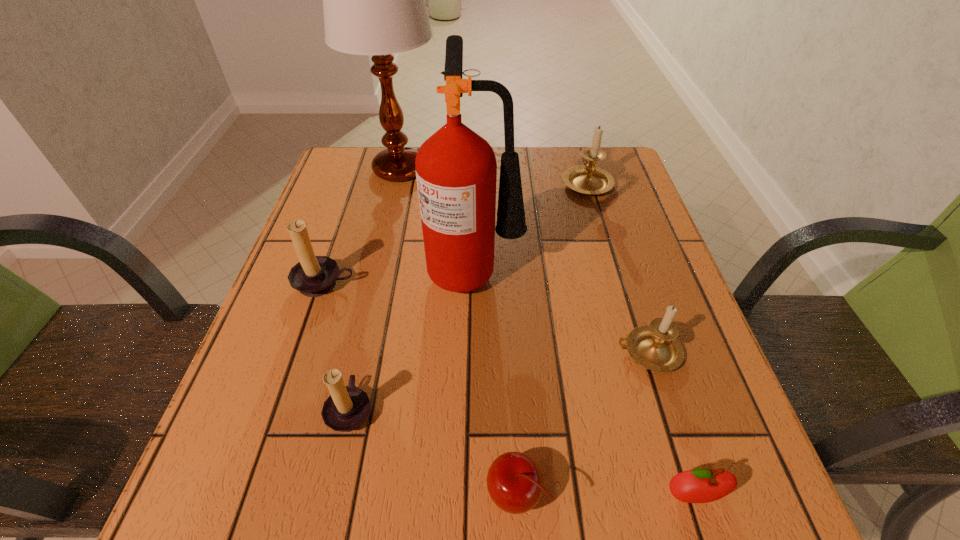
The image size is (960, 540). Identify the location of free space that is in between the cherry and the third candle holder from right to left. (432, 451).

Where is `free space between the nearer beige candle holder and the cherry`? The image size is (960, 540). free space between the nearer beige candle holder and the cherry is located at coordinates (581, 422).

The width and height of the screenshot is (960, 540). Identify the location of unoccupied position between the sixth farthest object and the bigger beige candle holder. (468, 295).

In order to click on the sixth closest object to the cherry in this screenshot , I will do `click(588, 179)`.

You are a GUI agent. You are given a task and a screenshot of the screen. Output one action in this format:
    pyautogui.click(x=<x>, y=<y>)
    Task: Click on the closest object to the red fire extinguisher
    The width and height of the screenshot is (960, 540).
    Given the screenshot: What is the action you would take?
    pyautogui.click(x=314, y=276)

Choose which candle holder is the nearest neighbor to the nearer beige candle holder. Please provide its 2D coordinates. Your answer should be formatted as a tuple, i.e. [(x, y)], where the tuple contains the x and y coordinates of a point satisfying the conditions above.

[(588, 179)]

The image size is (960, 540). I want to click on candle holder that stands as the fourth closest to the white table lamp, so click(x=655, y=346).

I want to click on free spot that satisfies the following two spatial constraints: 1. on the wick of the nearer brown candle holder; 2. on the left side of the apple, so (331, 496).

Locate an element on the screen. The height and width of the screenshot is (540, 960). vacant area in the image that satisfies the following two spatial constraints: 1. on the wick of the apple; 2. on the right side of the nearest candle holder is located at coordinates (331, 496).

Identify the location of blank space that satisfies the following two spatial constraints: 1. at the nozzle of the cherry; 2. on the right side of the red fire extinguisher. (473, 493).